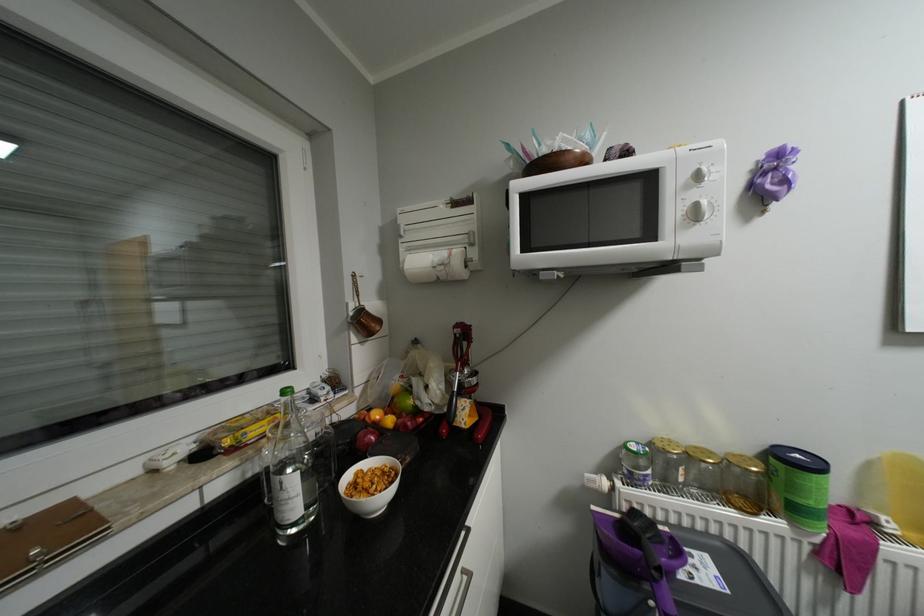
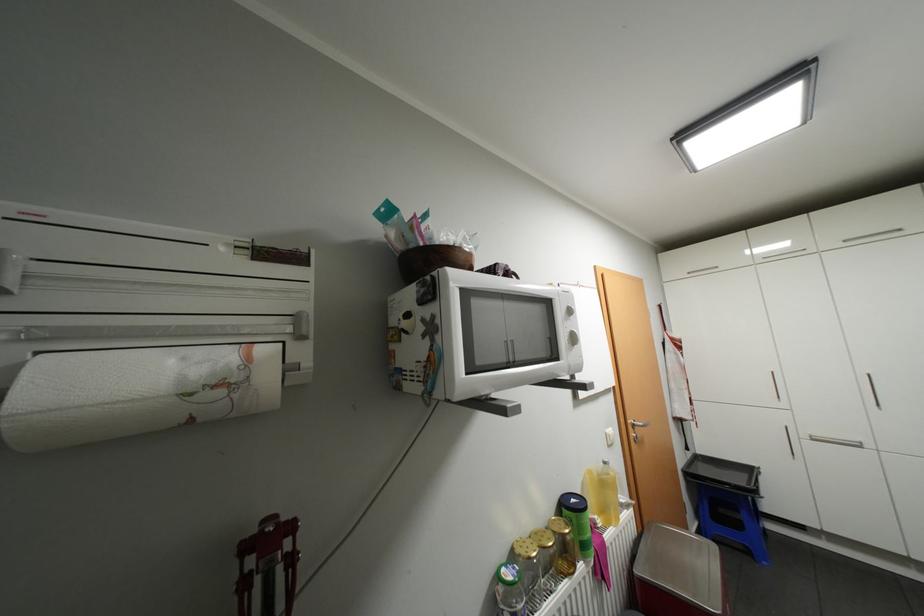
Where in the second image is the point corresponding to [480,244] from the first image?

(309, 336)